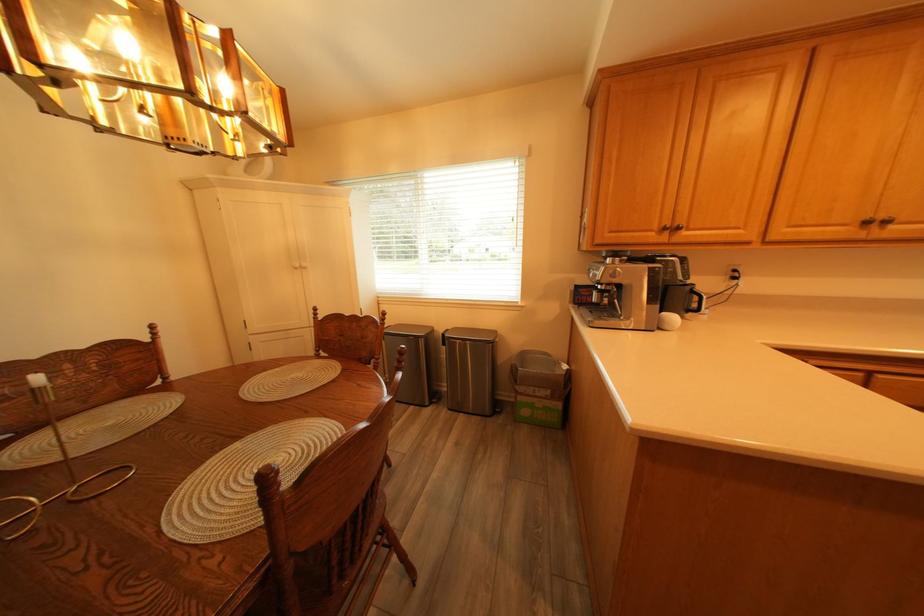
Identify the location of black mug handle. (698, 302).